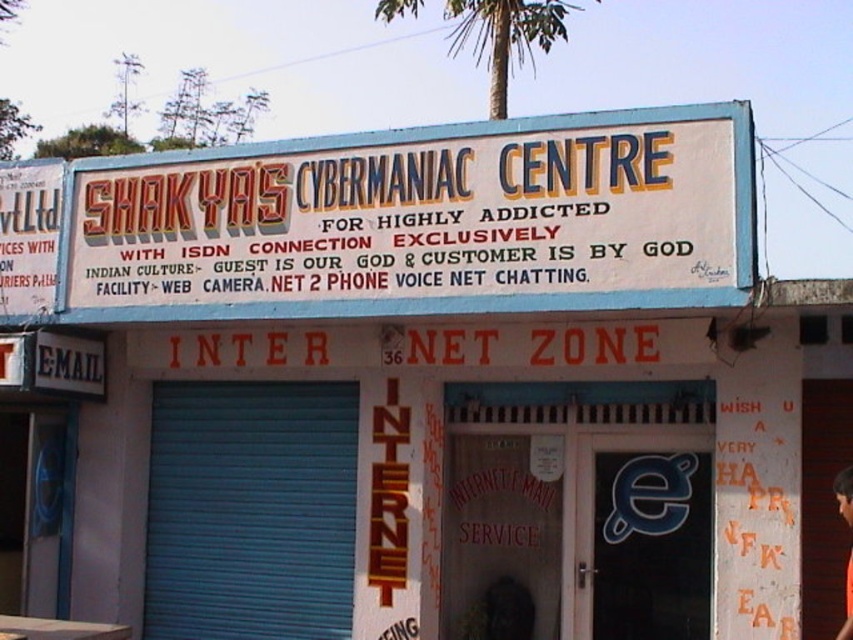
Can you confirm if white painted signboard at upper center is positioned to the right of green leafy palm tree at upper center?

No, white painted signboard at upper center is not to the right of green leafy palm tree at upper center.

Measure the distance between white painted signboard at upper center and camera.

white painted signboard at upper center is 23.65 feet away from camera.

Does point (695, 232) come farther from viewer compared to point (498, 88)?

No, it is not.

This screenshot has height=640, width=853. What are the coordinates of `white painted signboard at upper center` in the screenshot? It's located at (422, 220).

Between green leafy palm tree at upper center and orange fabric shirt at center, which one appears on the right side from the viewer's perspective?

Positioned to the right is orange fabric shirt at center.

In the scene shown: Does green leafy palm tree at upper center have a lesser width compared to orange fabric shirt at center?

Incorrect, green leafy palm tree at upper center's width is not less than orange fabric shirt at center's.

Is point (467, 19) in front of point (850, 516)?

No, it is behind (850, 516).

What are the coordinates of `green leafy palm tree at upper center` in the screenshot? It's located at (503, 36).

Which of these two, white painted signboard at upper center or orange fabric shirt at center, stands taller?

Standing taller between the two is white painted signboard at upper center.

Describe the element at coordinates (422, 220) in the screenshot. I see `white painted signboard at upper center` at that location.

The width and height of the screenshot is (853, 640). Identify the location of white painted signboard at upper center. (422, 220).

The height and width of the screenshot is (640, 853). Find the location of `white painted signboard at upper center`. white painted signboard at upper center is located at coordinates (422, 220).